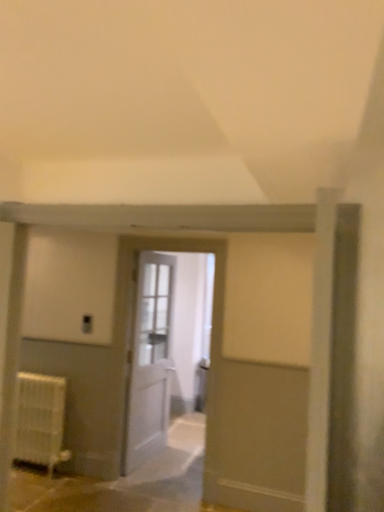
Question: Is white wooden door at center, which ranks as the first door in front-to-back order, inside or outside of white wooden door at center, acting as the 2th door starting from the front?

Choices:
 (A) inside
 (B) outside

Answer: (B)

Question: In the image, is white wooden door at center, which ranks as the first door in front-to-back order, on the left side or the right side of white wooden door at center, acting as the 2th door starting from the front?

Choices:
 (A) right
 (B) left

Answer: (A)

Question: Estimate the real-world distances between objects in this image. Which object is farther from the white wooden door at center, which is the 1th door in back-to-front order?

Choices:
 (A) white wooden door at center, which is counted as the 2th door, starting from the back
 (B) white matte radiator at lower left

Answer: (B)

Question: Estimate the real-world distances between objects in this image. Which object is farther from the white wooden door at center, acting as the 2th door starting from the front?

Choices:
 (A) white matte radiator at lower left
 (B) white wooden door at center, which ranks as the first door in front-to-back order

Answer: (A)